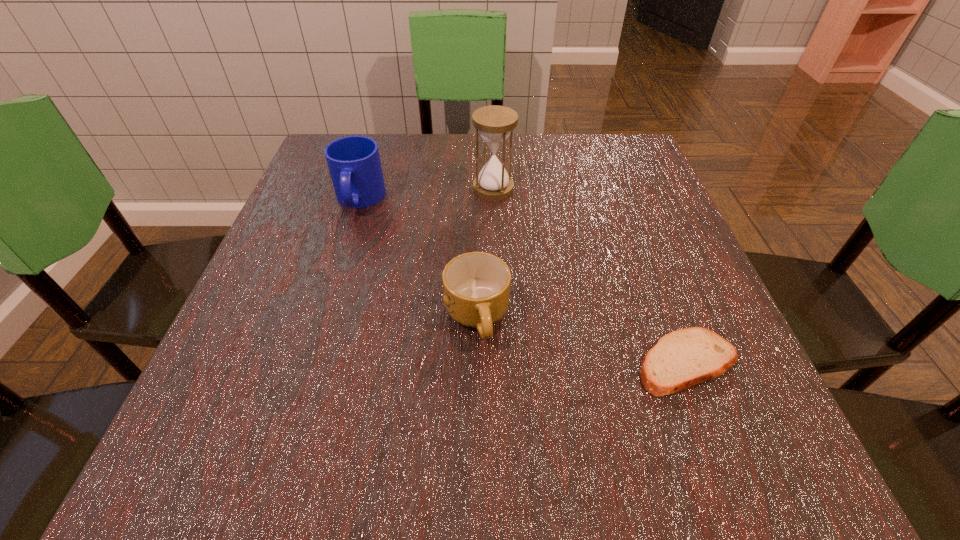
Where is `blank area located 0.060m on the left of the pita bread`? The image size is (960, 540). blank area located 0.060m on the left of the pita bread is located at coordinates click(595, 363).

Where is `hourglass that is at the far edge`? The image size is (960, 540). hourglass that is at the far edge is located at coordinates (494, 123).

Where is `mug that is at the far edge`? The image size is (960, 540). mug that is at the far edge is located at coordinates (354, 164).

Locate an element on the screen. This screenshot has height=540, width=960. object present at the left edge is located at coordinates (354, 164).

This screenshot has height=540, width=960. I want to click on object located in the right edge section of the desktop, so tap(681, 359).

At what (x,y) coordinates should I click in order to perform the action: click on object situated at the far left corner. Please return your answer as a coordinate pair (x, y). This screenshot has width=960, height=540. Looking at the image, I should click on pos(354,164).

You are a GUI agent. You are given a task and a screenshot of the screen. Output one action in this format:
    pyautogui.click(x=<x>, y=<y>)
    Task: Click on the vacant space at the far edge of the desktop
    The width and height of the screenshot is (960, 540).
    Given the screenshot: What is the action you would take?
    pos(548,152)

The image size is (960, 540). Identify the location of vacant space at the near edge of the desktop. (332, 475).

The height and width of the screenshot is (540, 960). In the image, there is a desktop. Find the location of `free region at the left edge`. free region at the left edge is located at coordinates (297, 226).

Where is `free space at the right edge`? The width and height of the screenshot is (960, 540). free space at the right edge is located at coordinates (637, 193).